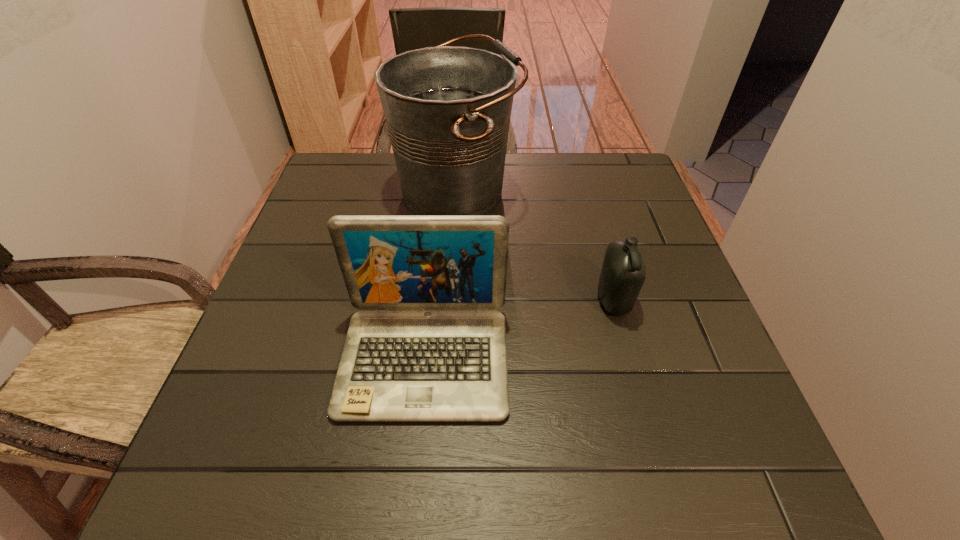
Where is `vacant space that is in between the farthest object and the bottle`? Image resolution: width=960 pixels, height=540 pixels. vacant space that is in between the farthest object and the bottle is located at coordinates (535, 246).

Where is `free spot between the bottle and the bucket`? Image resolution: width=960 pixels, height=540 pixels. free spot between the bottle and the bucket is located at coordinates (535, 246).

Locate which object is the closest to the shortest object. Please provide its 2D coordinates. Your answer should be formatted as a tuple, i.e. [(x, y)], where the tuple contains the x and y coordinates of a point satisfying the conditions above.

[(427, 346)]

Locate an element on the screen. This screenshot has width=960, height=540. the closest object to the shortest object is located at coordinates (427, 346).